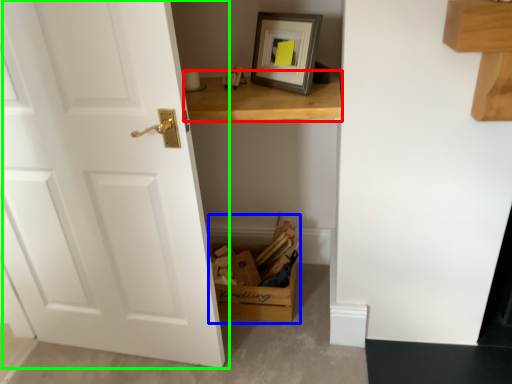
Question: Based on their relative distances, which object is farther from table (highlighted by a red box)? Choose from cardboard box (highlighted by a blue box) and door (highlighted by a green box).

Choices:
 (A) cardboard box
 (B) door

Answer: (A)